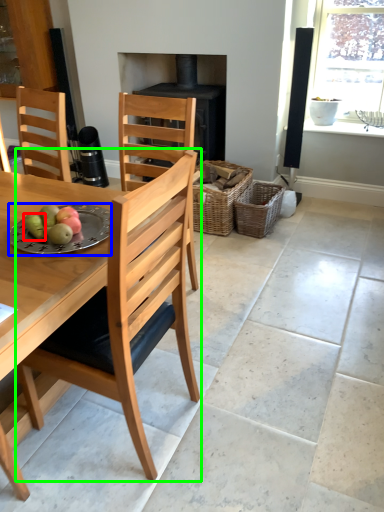
Question: Estimate the real-world distances between objects in this image. Which object is farther from fruit (highlighted by a red box), plate (highlighted by a blue box) or chair (highlighted by a green box)?

Choices:
 (A) plate
 (B) chair

Answer: (B)